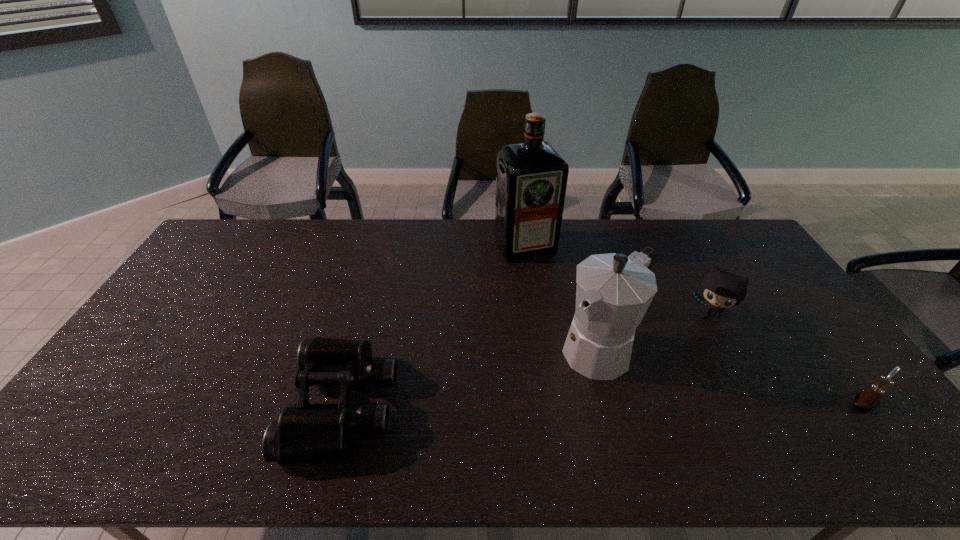
Locate an element on the screen. free space located 0.190m on the left of the rightmost object is located at coordinates (774, 402).

You are a GUI agent. You are given a task and a screenshot of the screen. Output one action in this format:
    pyautogui.click(x=<x>, y=<y>)
    Task: Click on the vacant space located 0.240m on the front-facing side of the kitten
    
    Given the screenshot: What is the action you would take?
    pyautogui.click(x=678, y=385)

Find the location of a particular element. The width and height of the screenshot is (960, 540). vacant area situated on the front-facing side of the kitten is located at coordinates (669, 404).

Where is `vacant region located on the front-facing side of the kitten`? The image size is (960, 540). vacant region located on the front-facing side of the kitten is located at coordinates coord(678,385).

This screenshot has width=960, height=540. Identify the location of vacant space situated at the spout of the coffeepot. (524, 418).

Where is `free space located at the spout of the coffeepot`? The image size is (960, 540). free space located at the spout of the coffeepot is located at coordinates (560, 386).

The width and height of the screenshot is (960, 540). In order to click on vacant area situated at the spout of the coffeepot in this screenshot , I will do `click(558, 388)`.

Locate an element on the screen. vacant region located on the front label of the tallest object is located at coordinates (547, 285).

Identify the location of free space located on the front label of the tallest object. This screenshot has width=960, height=540. (557, 301).

Where is `blank space located 0.260m on the front label of the tallest object`? This screenshot has height=540, width=960. blank space located 0.260m on the front label of the tallest object is located at coordinates (564, 314).